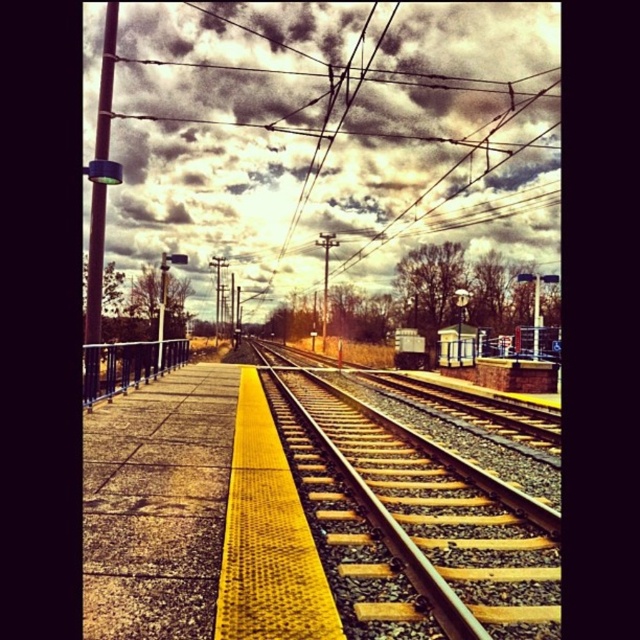
Question: Is the position of yellow gravel track at center less distant than that of metallic railing at left?

Choices:
 (A) yes
 (B) no

Answer: (B)

Question: Which object appears closest to the camera in this image?

Choices:
 (A) metallic railing at left
 (B) cloudy sky at upper center
 (C) metallic wires at center
 (D) yellow gravel track at center

Answer: (A)

Question: Is metallic wires at center below metallic railing at left?

Choices:
 (A) yes
 (B) no

Answer: (B)

Question: Does metallic wires at center come in front of metallic railing at left?

Choices:
 (A) no
 (B) yes

Answer: (A)

Question: Which point is closer to the camera?

Choices:
 (A) (381, 26)
 (B) (314, 10)
 (C) (493, 637)
 (D) (124, 378)

Answer: (C)

Question: Which point is closer to the camera?

Choices:
 (A) (285, 435)
 (B) (195, 243)
 (C) (301, 132)
 (D) (189, 348)

Answer: (A)